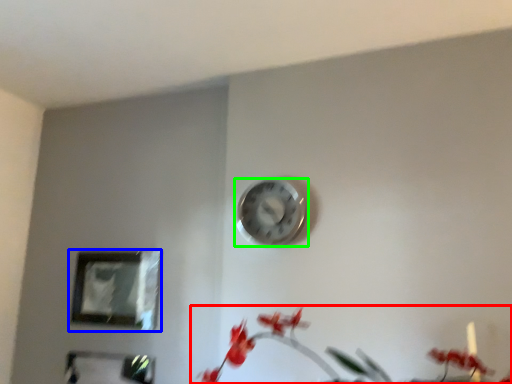
Question: Which is nearer to the floral arrangement (highlighted by a red box)? picture frame (highlighted by a blue box) or wall clock (highlighted by a green box).

Choices:
 (A) picture frame
 (B) wall clock

Answer: (B)